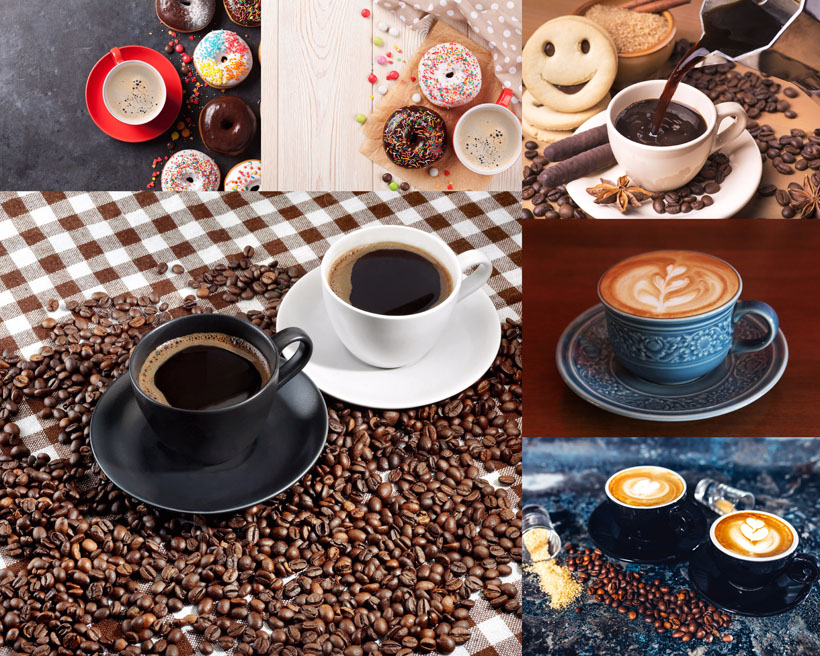
The image size is (820, 656). I want to click on cups, so click(723, 569), click(652, 520), click(397, 331), click(221, 432), click(666, 358), click(657, 174), click(498, 108), click(153, 112).